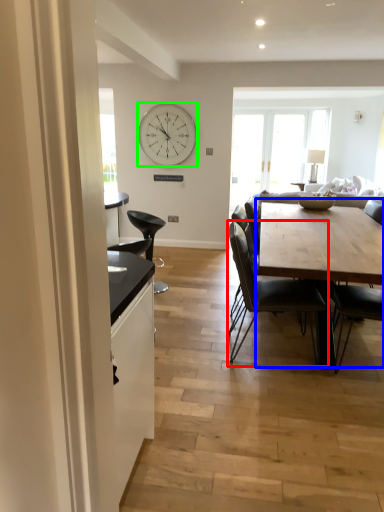
Question: Based on their relative distances, which object is farther from chair (highlighted by a red box)? Choose from table (highlighted by a blue box) and clock (highlighted by a green box).

Choices:
 (A) table
 (B) clock

Answer: (B)